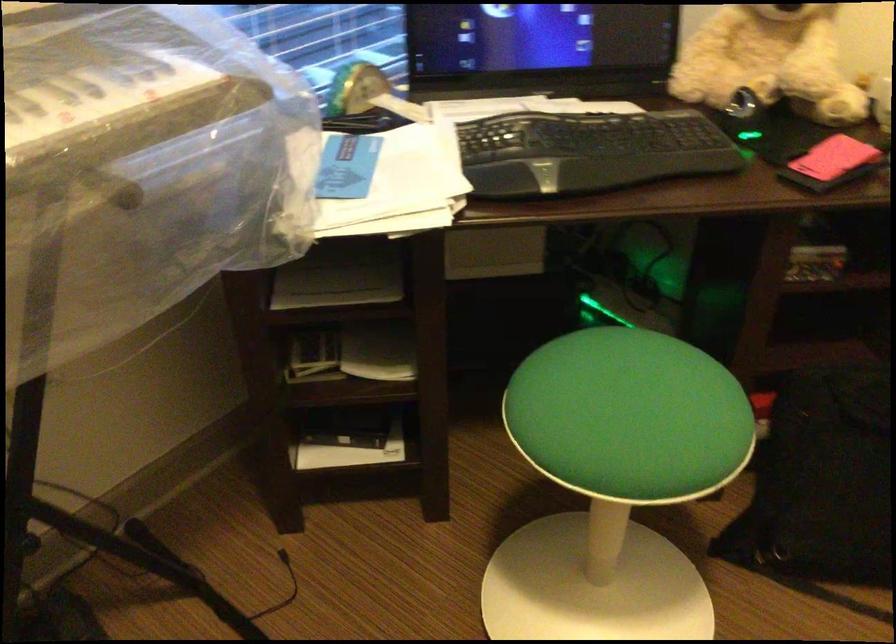
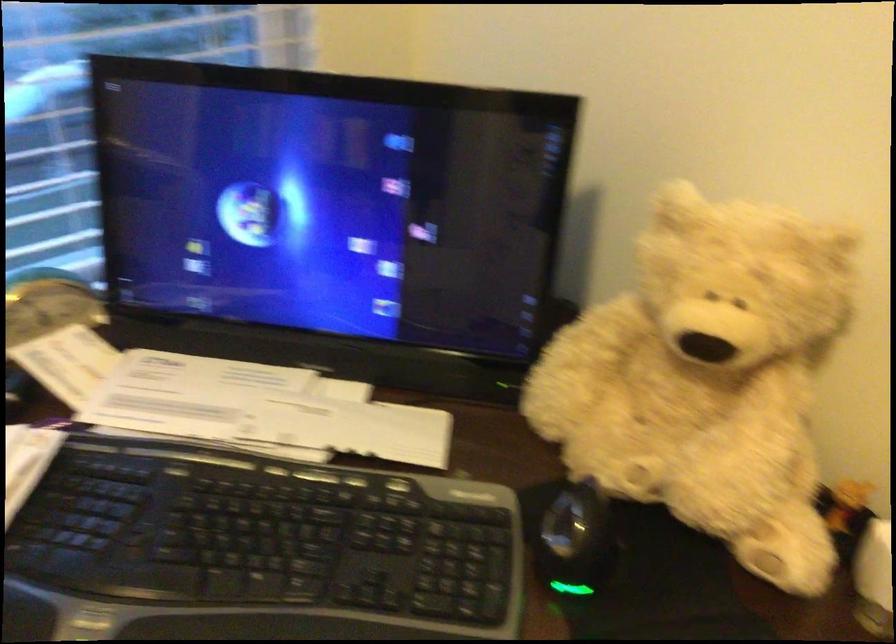
Question: How did the camera likely rotate?

Choices:
 (A) Left
 (B) Right
 (C) Up
 (D) Down

Answer: (A)